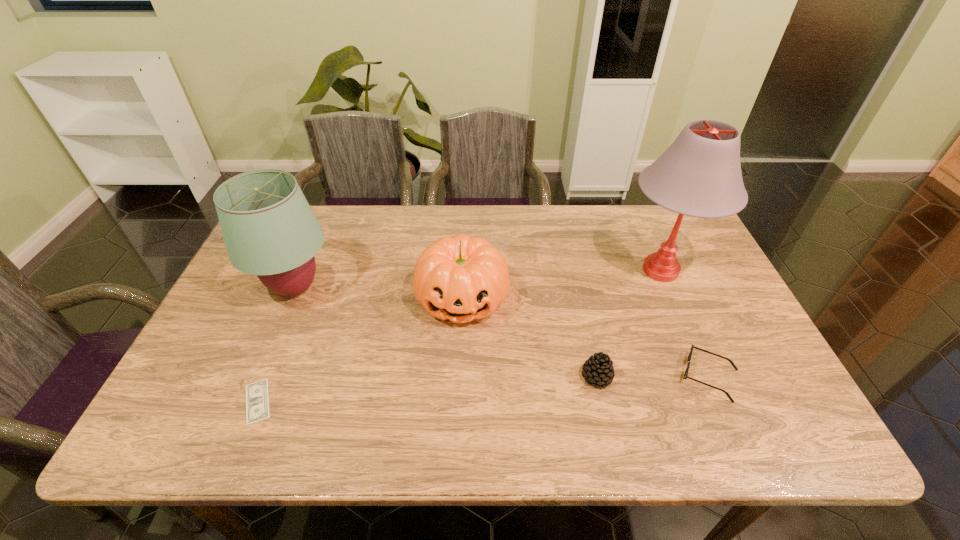
Image resolution: width=960 pixels, height=540 pixels. Identify the location of vacant region located on the front-facing side of the table lamp. (540, 270).

Identify the location of vacant area situated on the right of the lampshade. (448, 288).

The height and width of the screenshot is (540, 960). What are the coordinates of `vacant area situated 0.080m on the carved face of the fourth shortest object` in the screenshot? It's located at (460, 359).

Locate an element on the screen. Image resolution: width=960 pixels, height=540 pixels. vacant point located 0.370m at the narrow end of the fourth object from left to right is located at coordinates (425, 376).

Where is `vacant region located 0.060m at the narrow end of the fourth object from left to right`? The image size is (960, 540). vacant region located 0.060m at the narrow end of the fourth object from left to right is located at coordinates (556, 376).

Where is `free space located at the narrow end of the fourth object from left to right`? free space located at the narrow end of the fourth object from left to right is located at coordinates pyautogui.click(x=434, y=376).

Where is `vacant space situated on the lenses of the sunglasses`? Image resolution: width=960 pixels, height=540 pixels. vacant space situated on the lenses of the sunglasses is located at coordinates pyautogui.click(x=606, y=377).

The width and height of the screenshot is (960, 540). In order to click on free spot located 0.110m on the lenses of the sunglasses in this screenshot , I will do `click(632, 377)`.

Locate an element on the screen. vacant space situated 0.210m on the lenses of the sunglasses is located at coordinates (589, 377).

You are a GUI agent. You are given a task and a screenshot of the screen. Output one action in this format:
    pyautogui.click(x=<x>, y=<y>)
    Task: Click on the free space located on the back of the shortest object
    Image resolution: width=960 pixels, height=540 pixels.
    Given the screenshot: What is the action you would take?
    pyautogui.click(x=312, y=267)